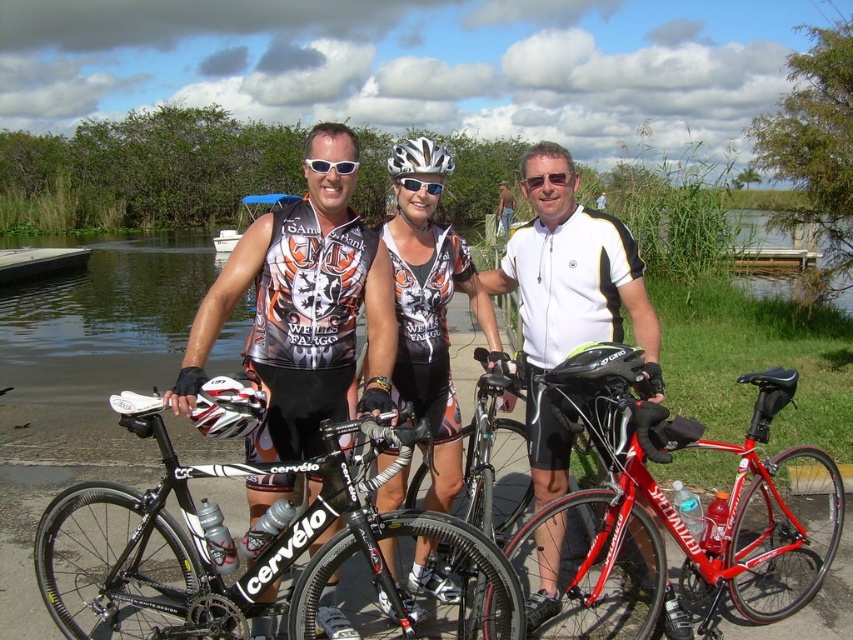
You are a photographer who wants to take a closeup shot of the black matte bicycle at center. The camera you are using has a focal length of 50mm. If you want to focus on the bicycle, which is located at coordinates point 0.856, 0.275, what should you adjust on your camera?

You should adjust the focus ring on your camera to the distance corresponding to the coordinates point [234,547] to ensure the black matte bicycle at center is in sharp focus.